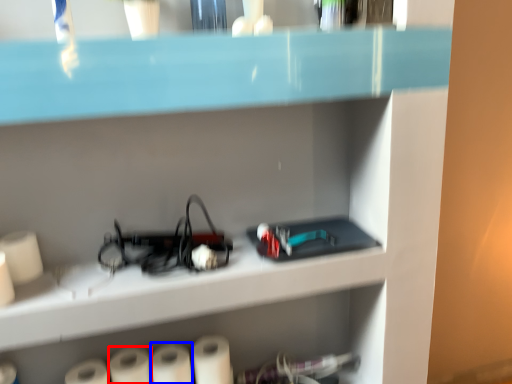
Question: Which point is further to the camera, paper towel (highlighted by a red box) or paper towel (highlighted by a blue box)?

Choices:
 (A) paper towel
 (B) paper towel

Answer: (B)